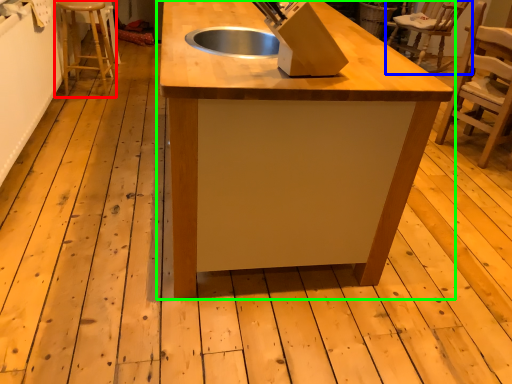
Question: Considering the real-world distances, which object is farthest from step stool (highlighted by a red box)? chair (highlighted by a blue box) or table (highlighted by a green box)?

Choices:
 (A) chair
 (B) table

Answer: (A)